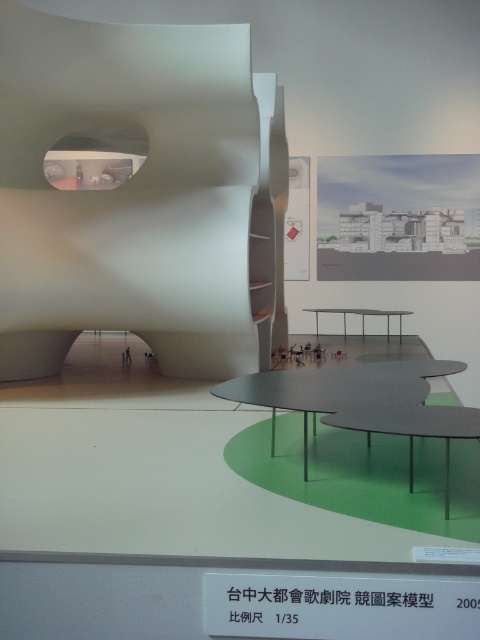
Question: In this image, where is matte white sculpture at center located relative to matte gray table at center?

Choices:
 (A) left
 (B) right

Answer: (A)

Question: From the image, what is the correct spatial relationship of matte white sculpture at center in relation to matte gray table at center?

Choices:
 (A) right
 (B) left

Answer: (B)

Question: Which point appears farthest from the camera in this image?

Choices:
 (A) (41, 324)
 (B) (361, 317)
 (C) (309, 378)

Answer: (B)

Question: Where is matte gray table at center located in relation to metallic gray table at center in the image?

Choices:
 (A) below
 (B) above

Answer: (A)

Question: Which point is farther to the camera?

Choices:
 (A) (333, 406)
 (B) (331, 308)
 (C) (439, 433)

Answer: (B)

Question: Which point is closer to the camera taking this photo?

Choices:
 (A) (394, 426)
 (B) (254, 157)
 (C) (248, 376)
 (D) (316, 321)

Answer: (A)